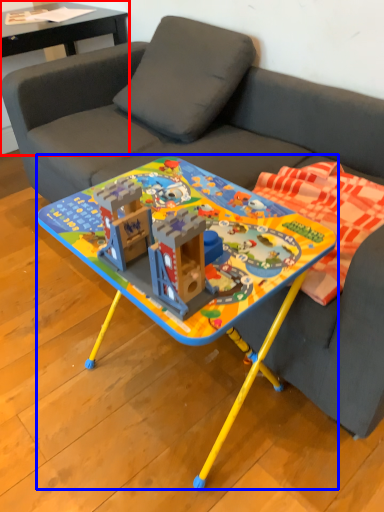
Question: Which point is closer to the camera, side table (highlighted by a red box) or table (highlighted by a blue box)?

Choices:
 (A) side table
 (B) table

Answer: (B)